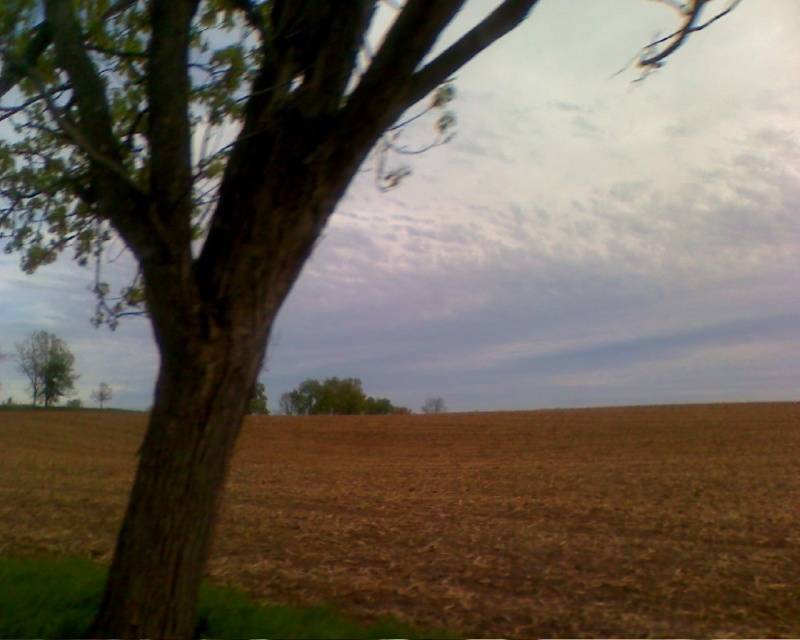
You are standing in the rural landscape and want to climb the tallest tree. Which tree should you choose between the green leafy tree at left and the green matte tree at center?

The green leafy tree at left is taller than the green matte tree at center, so you should choose the green leafy tree at left to climb.

You are standing at the point marked by the coordinates point (46,365). Looking towards the green leafy tree at left, which direction should you walk to reach the tree?

The point (46,365) is the location of the green leafy tree at left, so you are already at the tree.

You are a bird looking for a place to perch. You see the green leafy tree at left and the green matte tree at lower left. Which tree should you choose if you want to be higher up?

The green leafy tree at left is much taller than the green matte tree at lower left, so you should choose the green leafy tree at left to be higher up.